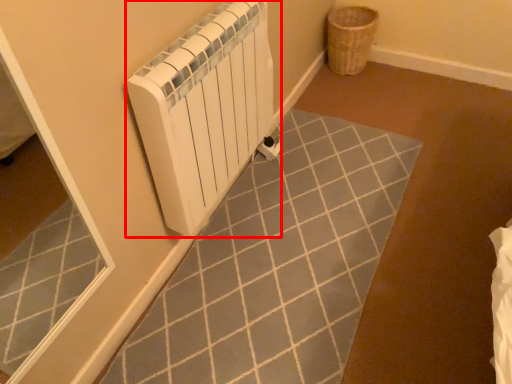
Question: From the image's perspective, what is the correct spatial positioning of bath heater (annotated by the red box) in reference to basket?

Choices:
 (A) below
 (B) above

Answer: (A)